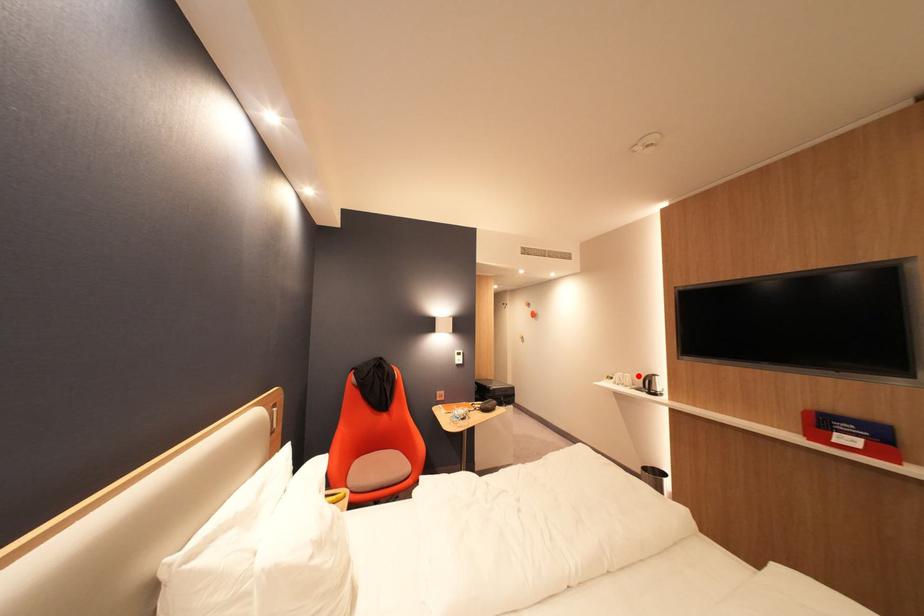
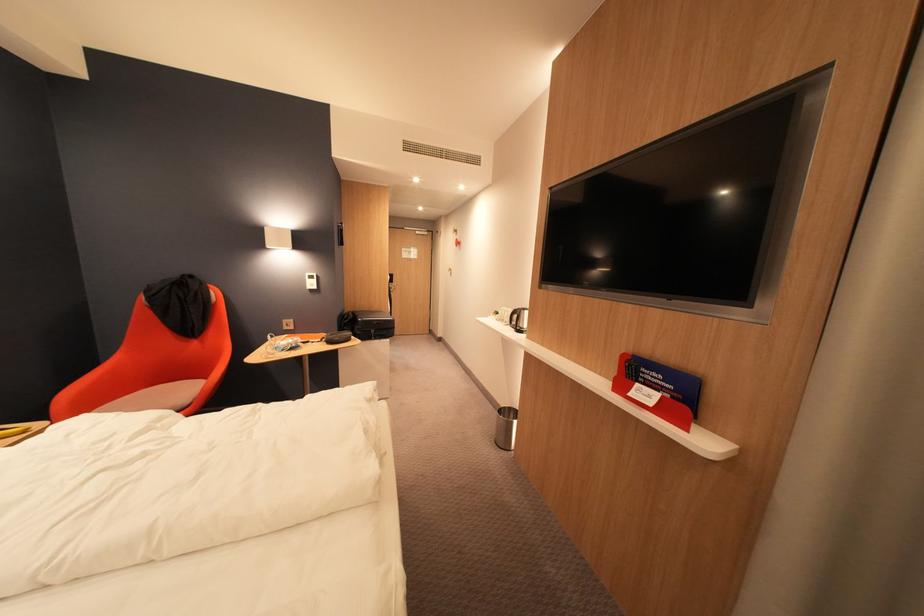
Where in the second image is the point corresponding to the highlighted location from the first image?

(519, 310)